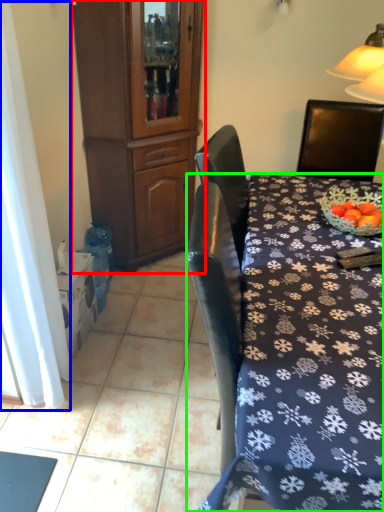
Question: Estimate the real-world distances between objects in this image. Which object is farther from cabinetry (highlighted by a red box), curtain (highlighted by a blue box) or desk (highlighted by a green box)?

Choices:
 (A) curtain
 (B) desk

Answer: (B)